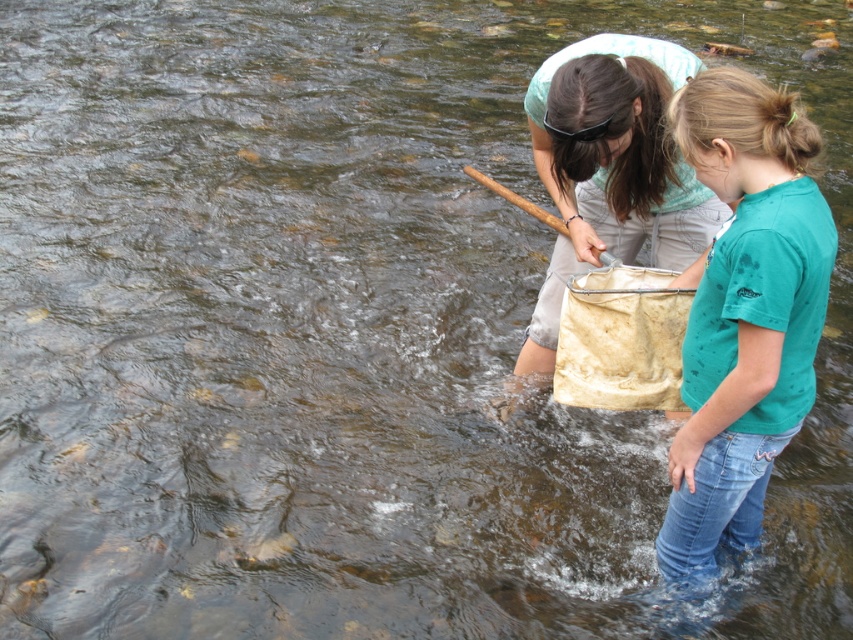
You are a photographer trying to capture a closeup of the two points in the image. Which point, point (825, 278) or point (540, 81), is closer to your camera lens?

Point (825, 278) is closer to the viewer than point (540, 81), so it would be closer to the camera lens.

You are a photographer trying to capture the scene with the teal matte shirt at right. What are the coordinates where you should focus your camera?

The coordinates to focus on are point [744,314] where the teal matte shirt at right is located.

You are a photographer trying to capture a photo of the light blue fabric net at center while ensuring the teal matte shirt at right is visible in the frame. Based on their positions, can you position yourself so that both objects are in the shot without moving either?

Yes, since the teal matte shirt at right is on the right side of the light blue fabric net at center, positioning yourself to the left of the net would allow both the net and the shirt to be in the frame.